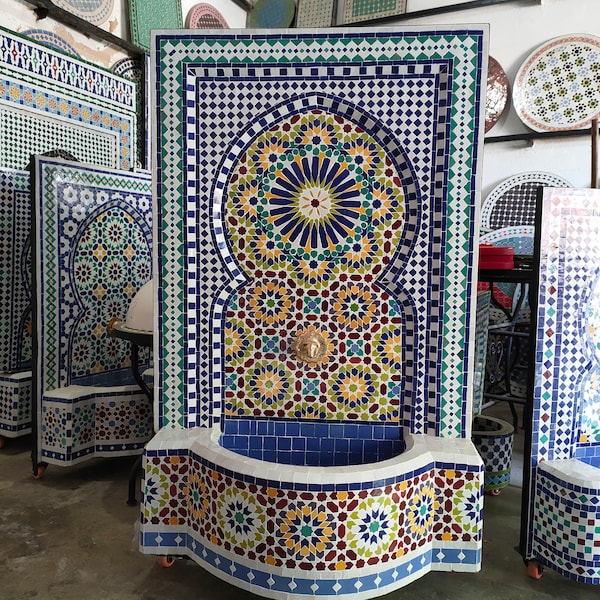
At what (x,y) coordinates should I click in order to perform the action: click on moroccan mosaic tile fountain. Please return your answer as a coordinate pair (x, y). This screenshot has height=600, width=600. Looking at the image, I should click on (377, 278), (568, 306), (129, 249), (83, 143).